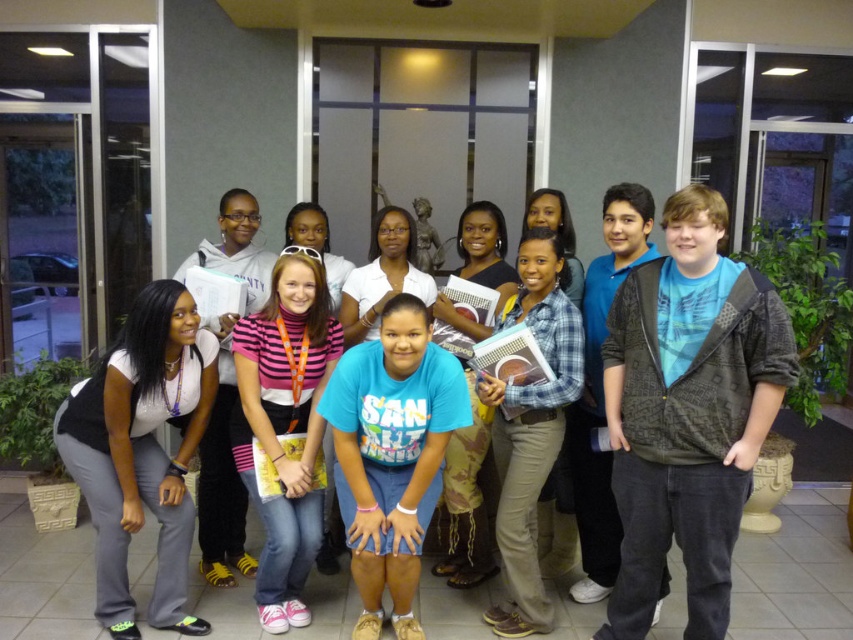
You are a photographer trying to capture a group photo of the white matte pants at lower left and the blue cotton shirt at center. Since you want to ensure both are visible in the frame, which direction should you position your camera relative to the subjects?

The white matte pants at lower left is positioned on the left side of blue cotton shirt at center. To ensure both are visible in the frame, position the camera to the right side of the subjects so that the white matte pants at lower left and blue cotton shirt at center are both within the camera view.